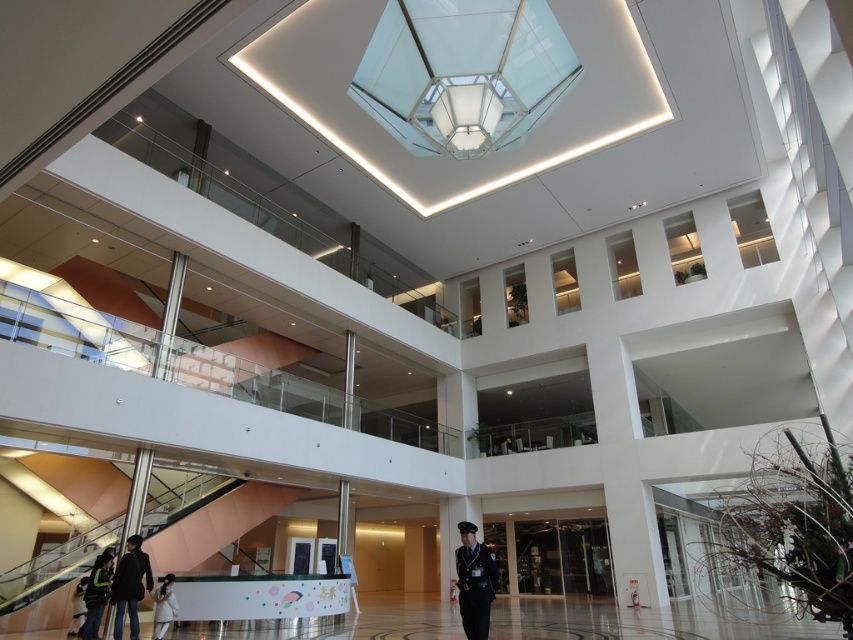
Is dark gray fabric jacket at lower left below white fuzzy coat at lower left?

Incorrect, dark gray fabric jacket at lower left is not positioned below white fuzzy coat at lower left.

Does point (134, 548) come in front of point (164, 582)?

Yes, it is.

Find the location of a particular element. dark gray fabric jacket at lower left is located at coordinates (129, 586).

Is point (486, 624) farther from camera compared to point (160, 618)?

No, (486, 624) is in front of (160, 618).

From the picture: Who is taller, uniformed officer at center or white fuzzy coat at lower left?

uniformed officer at center is taller.

Who is more distant from viewer, (486,557) or (164,609)?

The point (164,609) is behind.

Identify the location of uniformed officer at center. Image resolution: width=853 pixels, height=640 pixels. (474, 580).

Is uniformed officer at center wider than dark gray fabric jacket at lower left?

No.

Between point (471, 589) and point (119, 611), which one is positioned in front?

Point (471, 589)

Identify the location of uniformed officer at center. (474, 580).